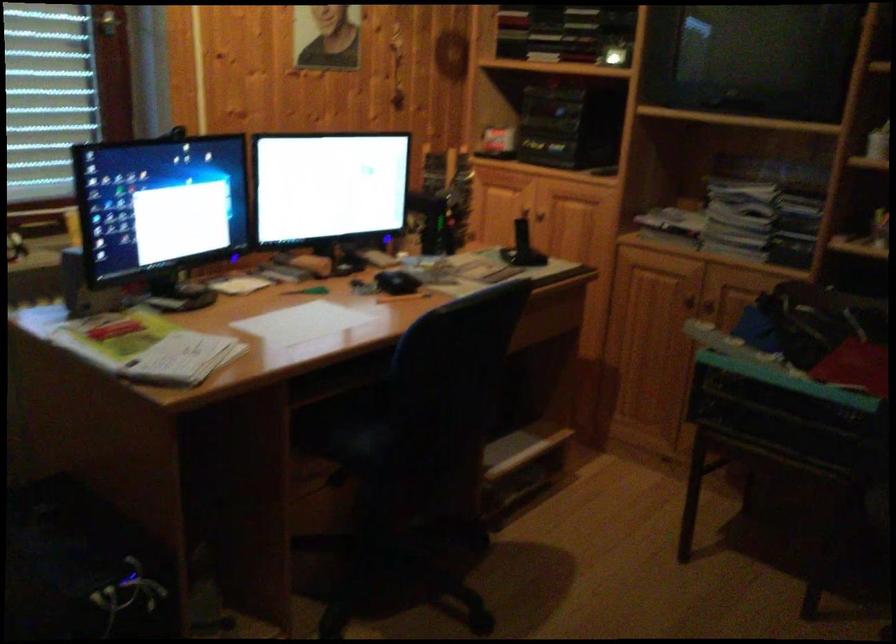
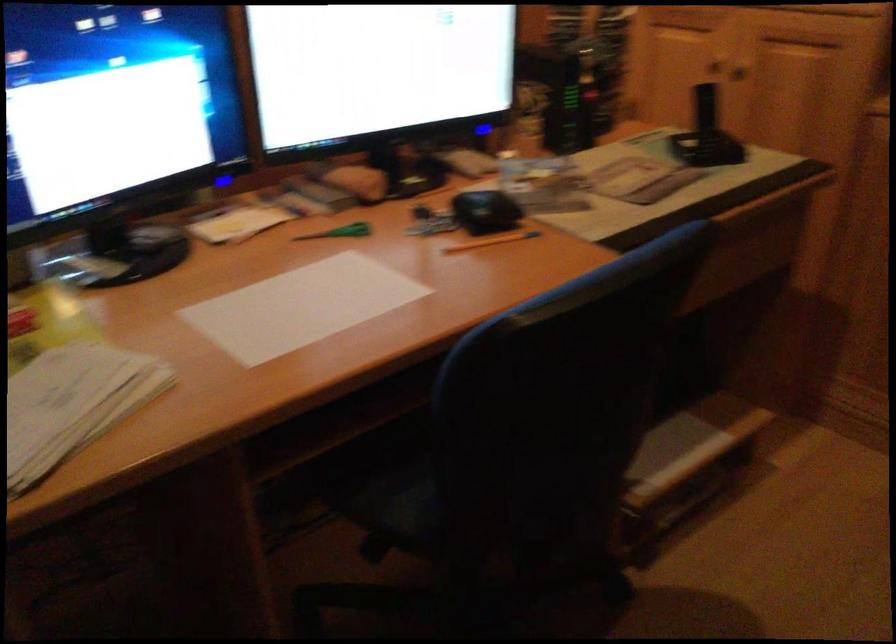
Where in the second image is the point corresponding to (x=357, y=431) from the first image?

(400, 488)